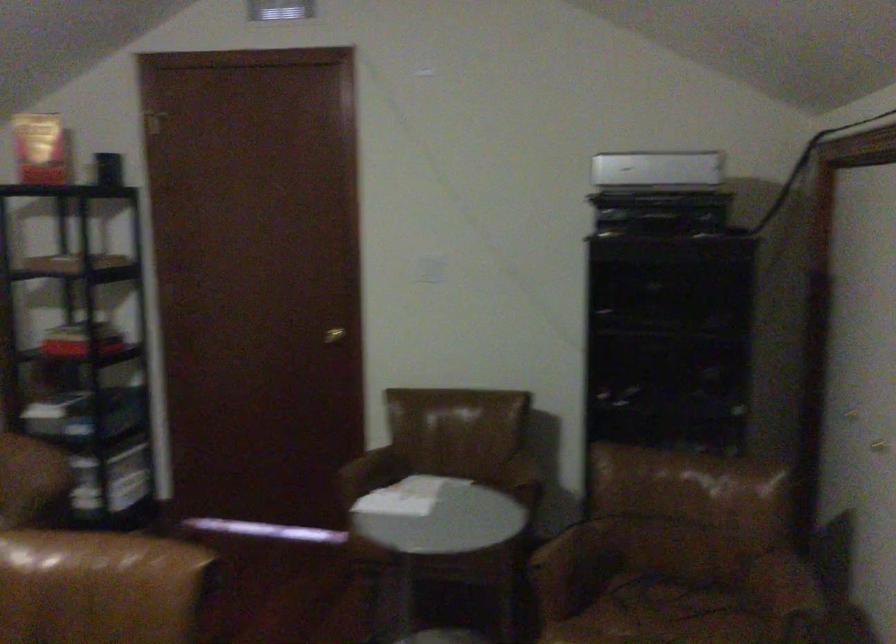
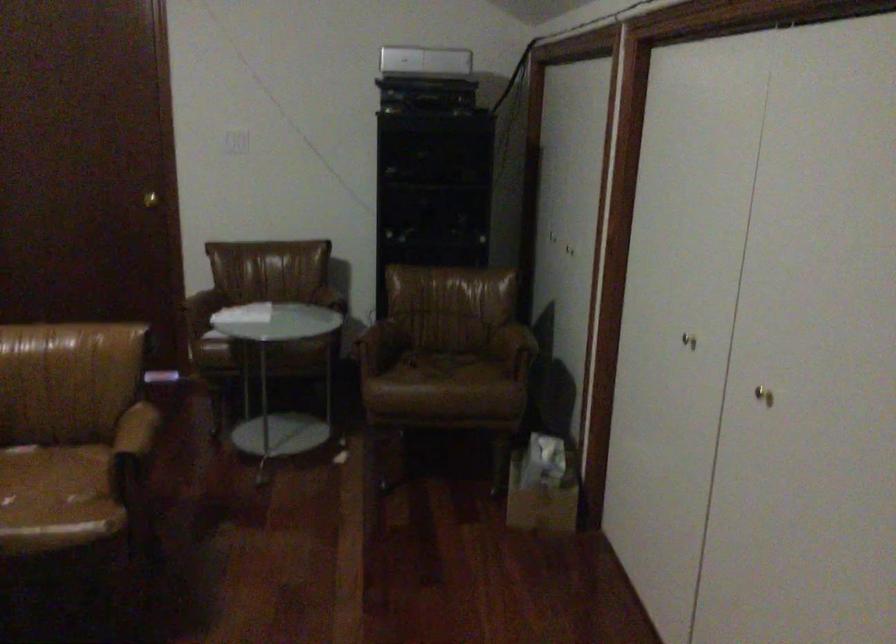
What movement of the cameraman would produce the second image?

The cameraman moved toward left, backward.